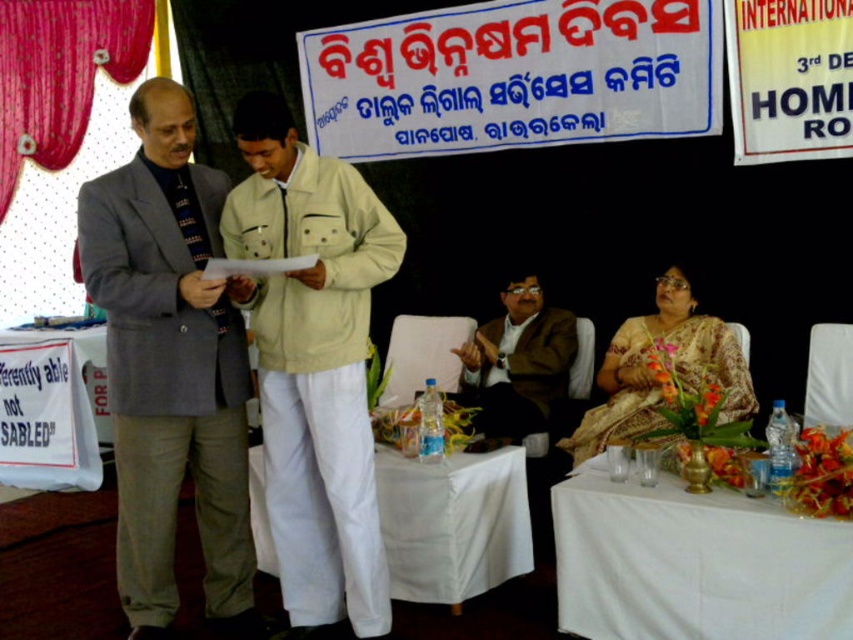
Question: Is white cloth-covered table at center to the right of beige floral saree at lower right from the viewer's perspective?

Choices:
 (A) no
 (B) yes

Answer: (A)

Question: Observing the image, what is the correct spatial positioning of white cloth-covered table at center in reference to brown textured suit at center?

Choices:
 (A) left
 (B) right

Answer: (A)

Question: Which object is positioned closest to the beige fabric jacket at center?

Choices:
 (A) white cloth-covered table at center
 (B) white cloth table at lower right
 (C) gray woolen suit at left
 (D) beige floral saree at lower right

Answer: (C)

Question: Which of the following is the farthest from the observer?

Choices:
 (A) white cloth table at lower right
 (B) brown textured suit at center
 (C) white cloth-covered table at center
 (D) gray woolen suit at left

Answer: (B)

Question: Which of the following is the farthest from the observer?

Choices:
 (A) (730, 387)
 (B) (236, 317)
 (C) (491, 355)
 (D) (325, 604)

Answer: (C)

Question: Is gray woolen suit at left thinner than white cloth-covered table at center?

Choices:
 (A) yes
 (B) no

Answer: (A)